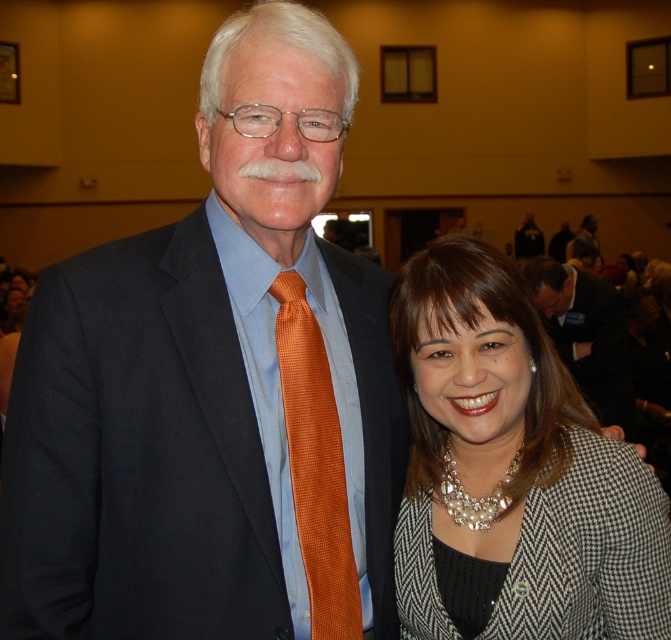
You are a photographer adjusting the camera settings to capture the two people in the scene. Since you want to ensure both the matte orange tie at center and the matte black suit at center are clearly visible, which item requires more careful focus adjustment due to its smaller size?

The matte orange tie at center requires more careful focus adjustment because its width is less than the matte black suit at center, making it smaller and potentially harder to focus on clearly.

Based on the photo, you are at a formal event and need to locate the matte orange tie at center and the matte black suit at center. From your perspective, which object is positioned to the left?

The matte orange tie at center is to the left of the matte black suit at center.

You are a photographer adjusting your camera settings to focus on the orange silk tie at center and the matte black suit at center. Which object should you focus on first to ensure both are in sharp focus?

The orange silk tie at center is closer to the viewer than the matte black suit at center, so you should focus on the orange silk tie at center first to ensure both are in sharp focus.